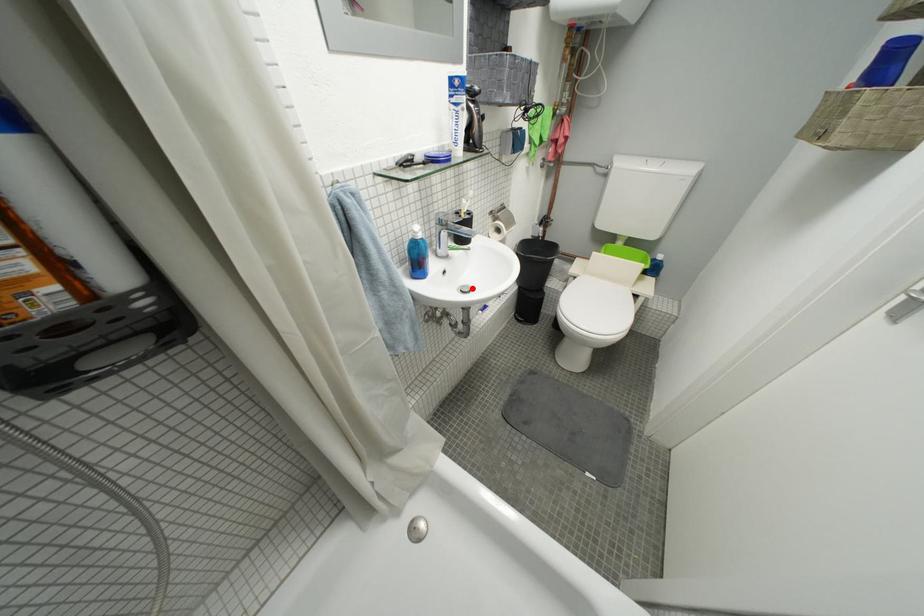
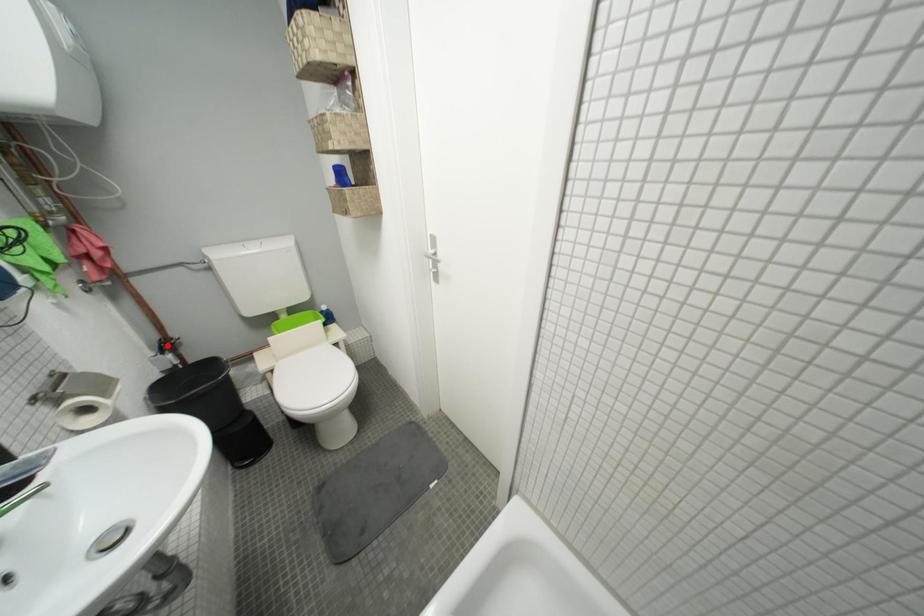
I am providing you with two images of the same scene from different viewpoints. A red point is marked on the first image and another point is marked on the second image. Does the point marked in image1 correspond to the same location as the one in image2?

No